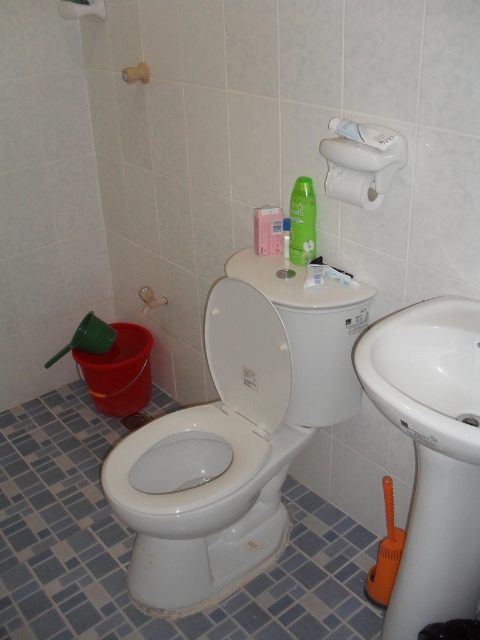
Which of these two, white ceramic sink at lower right or white matte toilet paper at upper right, stands shorter?

With less height is white matte toilet paper at upper right.

Does white ceramic sink at lower right have a lesser height compared to white matte toilet paper at upper right?

Incorrect, white ceramic sink at lower right's height does not fall short of white matte toilet paper at upper right's.

Which is behind, point (375, 324) or point (333, 163)?

The point (333, 163) is more distant.

Find the location of `white ceramic sink at lower right`. white ceramic sink at lower right is located at coordinates pyautogui.click(x=427, y=372).

Does white glossy toilet at center have a lesser width compared to green matte lotion at upper center?

No.

Who is more forward, (157, 451) or (296, 200)?

Point (296, 200)

You are a GUI agent. You are given a task and a screenshot of the screen. Output one action in this format:
    pyautogui.click(x=<x>, y=<y>)
    Task: Click on the white glossy toilet at center
    Image resolution: width=480 pixels, height=640 pixels.
    Given the screenshot: What is the action you would take?
    pyautogui.click(x=236, y=435)

Locate an element on the screen. The width and height of the screenshot is (480, 640). white glossy toilet at center is located at coordinates (236, 435).

Image resolution: width=480 pixels, height=640 pixels. What do you see at coordinates (427, 372) in the screenshot? I see `white ceramic sink at lower right` at bounding box center [427, 372].

Is white ceramic sink at lower right shorter than green matte lotion at upper center?

No.

Locate an element on the screen. Image resolution: width=480 pixels, height=640 pixels. white ceramic sink at lower right is located at coordinates (427, 372).

Image resolution: width=480 pixels, height=640 pixels. What are the coordinates of `white ceramic sink at lower right` in the screenshot? It's located at (427, 372).